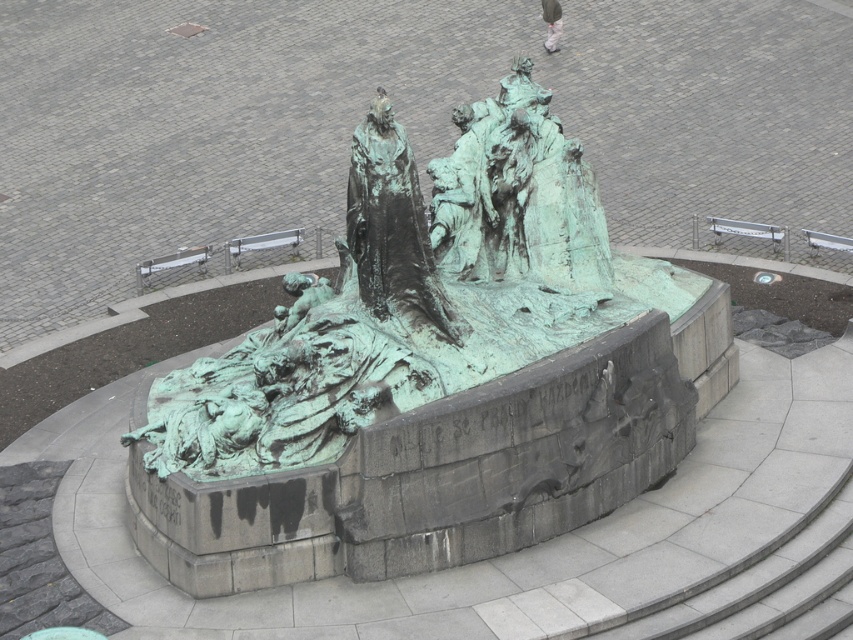
Which is more to the left, green patina sculpture at center or green patina statue at center?

green patina statue at center is more to the left.

Looking at this image, is green patina sculpture at center taller than green patina statue at center?

No, green patina sculpture at center is not taller than green patina statue at center.

Is point (647, 440) less distant than point (392, 268)?

No, (647, 440) is behind (392, 268).

Where is `green patina sculpture at center`? green patina sculpture at center is located at coordinates (433, 376).